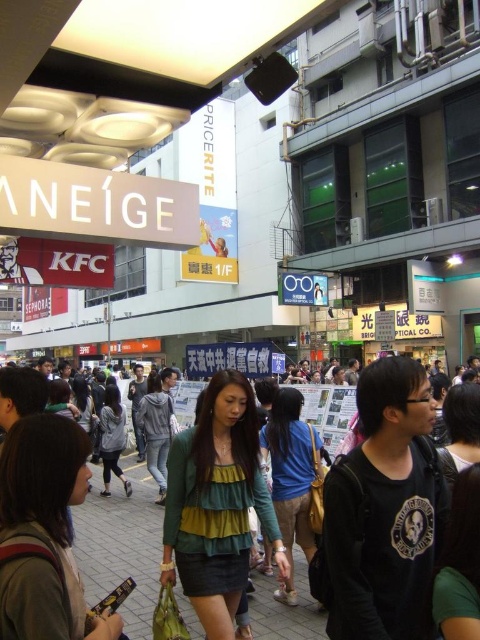
You are standing in the middle of the busy street scene and want to take a photo. There are two points in the image you want to focus on, point (66,484) and point (117,474). Which point should you focus on to ensure it appears clearer in the photo?

Point (66,484) is closer to the camera than point (117,474), so focusing on point (66,484) will make it appear clearer in the photo.

Based on the photo, you are a delivery robot positioned at the point with coordinates point (34,618). You need to deliver a package to the point with coordinates point (132,513). According to the scene description, which direction should you move to reach your destination?

Point (34,618) is in front of point (132,513), so you should move backward to reach point (132,513).

You are a tailor observing the urban street scene. You need to determine which clothing item is shorter in height between the green matte shirt at center and the gray hoodie at center. Based on the scene, which one is shorter?

The green matte shirt at center is shorter in height compared to the gray hoodie at center according to the description.